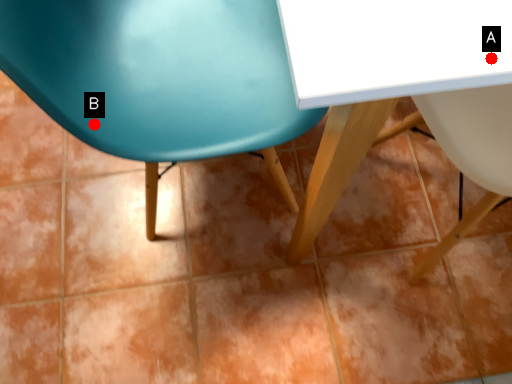
Question: Two points are circled on the image, labeled by A and B beside each circle. Which point is closer to the camera?

Choices:
 (A) A is closer
 (B) B is closer

Answer: (A)